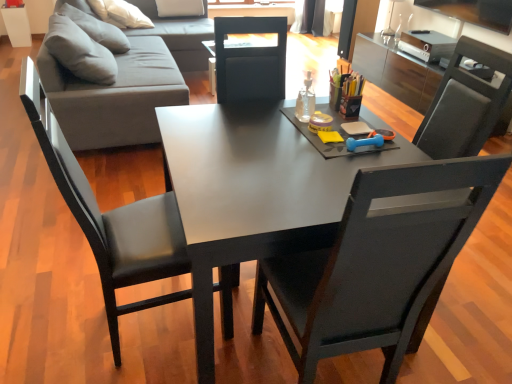
Question: From the image's perspective, is transparent glass bottle at center on matte black desk at center?

Choices:
 (A) no
 (B) yes

Answer: (B)

Question: Is transparent glass bottle at center at the right side of matte black desk at center?

Choices:
 (A) yes
 (B) no

Answer: (A)

Question: Would you say transparent glass bottle at center is outside matte black desk at center?

Choices:
 (A) yes
 (B) no

Answer: (A)

Question: Is transparent glass bottle at center surrounding matte black desk at center?

Choices:
 (A) yes
 (B) no

Answer: (B)

Question: Can you confirm if transparent glass bottle at center is shorter than matte black desk at center?

Choices:
 (A) yes
 (B) no

Answer: (A)

Question: Is point (99, 102) closer or farther from the camera than point (164, 122)?

Choices:
 (A) farther
 (B) closer

Answer: (A)

Question: From a real-world perspective, relative to matte black desk at center, is gray fabric couch at upper left vertically above or below?

Choices:
 (A) below
 (B) above

Answer: (B)

Question: From the image's perspective, relative to matte black desk at center, is gray fabric couch at upper left above or below?

Choices:
 (A) above
 (B) below

Answer: (A)

Question: Considering the positions of gray fabric couch at upper left and matte black desk at center in the image, is gray fabric couch at upper left taller or shorter than matte black desk at center?

Choices:
 (A) tall
 (B) short

Answer: (A)

Question: From a real-world perspective, is matte black desk at center above or below gray fabric couch at upper left?

Choices:
 (A) below
 (B) above

Answer: (A)

Question: Do you think matte black desk at center is within gray fabric couch at upper left, or outside of it?

Choices:
 (A) inside
 (B) outside

Answer: (B)

Question: Considering the positions of point [245, 256] and point [153, 36], is point [245, 256] closer or farther from the camera than point [153, 36]?

Choices:
 (A) farther
 (B) closer

Answer: (B)

Question: Considering the positions of matte black desk at center and gray fabric couch at upper left in the image, is matte black desk at center taller or shorter than gray fabric couch at upper left?

Choices:
 (A) short
 (B) tall

Answer: (A)

Question: Is point (309, 117) positioned closer to the camera than point (189, 21)?

Choices:
 (A) farther
 (B) closer

Answer: (B)

Question: In terms of width, does transparent glass bottle at center look wider or thinner when compared to gray fabric couch at upper left?

Choices:
 (A) wide
 (B) thin

Answer: (B)